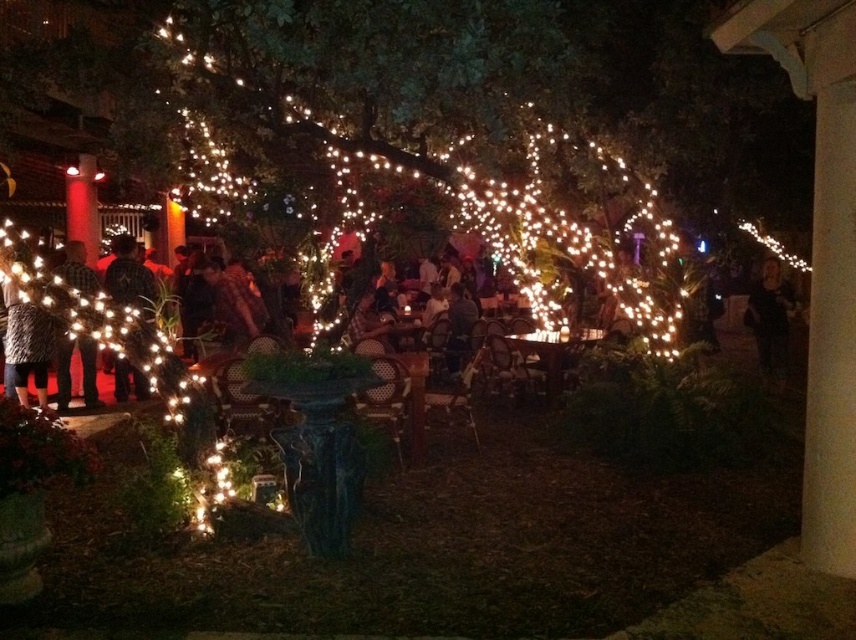
Question: Among these objects, which one is nearest to the camera?

Choices:
 (A) dark plaid shirt at left
 (B) dark gray sweater at left

Answer: (B)

Question: Considering the relative positions of dark gray sweater at left and dark brown leather jacket at left in the image provided, where is dark gray sweater at left located with respect to dark brown leather jacket at left?

Choices:
 (A) left
 (B) right

Answer: (A)

Question: Considering the relative positions of dark gray sweater at left and dark brown leather jacket at left in the image provided, where is dark gray sweater at left located with respect to dark brown leather jacket at left?

Choices:
 (A) left
 (B) right

Answer: (A)

Question: Among these objects, which one is farthest from the camera?

Choices:
 (A) dark plaid shirt at left
 (B) black matte person at right
 (C) dark brown leather jacket at left

Answer: (B)

Question: Does dark brown leather jacket at left have a greater width compared to dark plaid shirt at left?

Choices:
 (A) no
 (B) yes

Answer: (B)

Question: Which point is farther from the camera taking this photo?

Choices:
 (A) (9, 301)
 (B) (122, 298)
 (C) (81, 264)

Answer: (B)